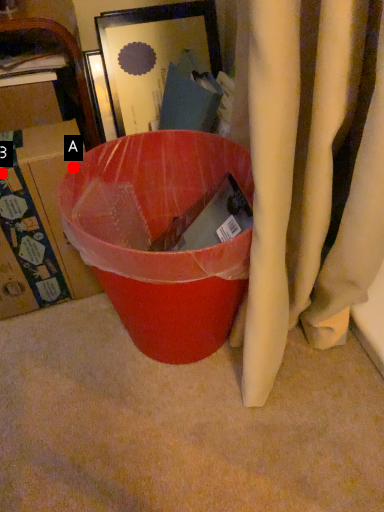
Question: Two points are circled on the image, labeled by A and B beside each circle. Which point is farther from the camera taking this photo?

Choices:
 (A) A is further
 (B) B is further

Answer: (B)